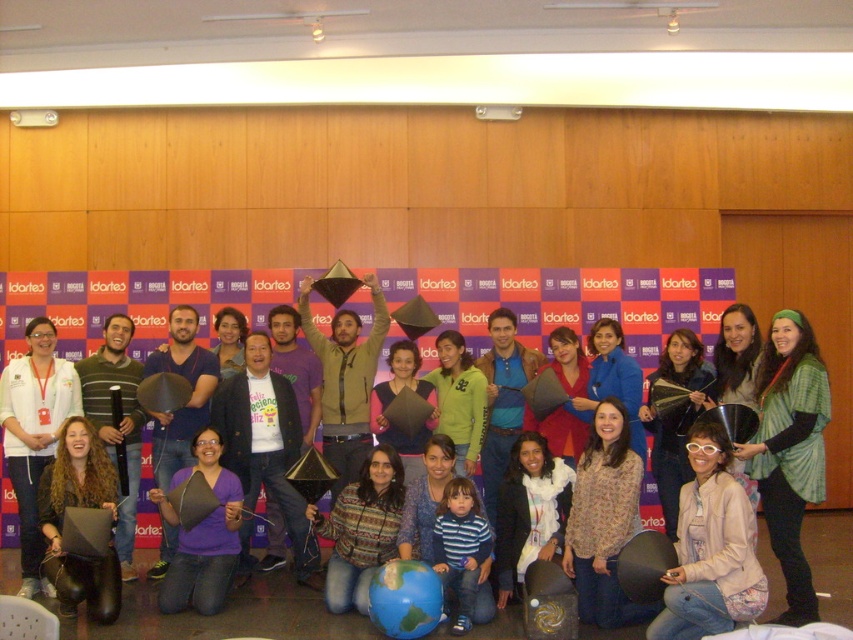
You are organizing a photo shoot and need to arrange two items in the scene for a balanced composition. The items are the floral print blouse at center and the matte black jacket at lower left. Based on their sizes, which item should be placed higher to create visual balance?

The floral print blouse at center should be placed higher because it is shorter than the matte black jacket at lower left, so elevating it can help balance the composition.

You are organizing a photo shoot and need to place a small decorative item on a table. You have a matte black graduation cap at center and a matte black jacket at lower left. Which object would be more suitable for the table if you want something compact?

The matte black graduation cap at center is smaller than the matte black jacket at lower left, so it would be more suitable for the table if you want something compact.